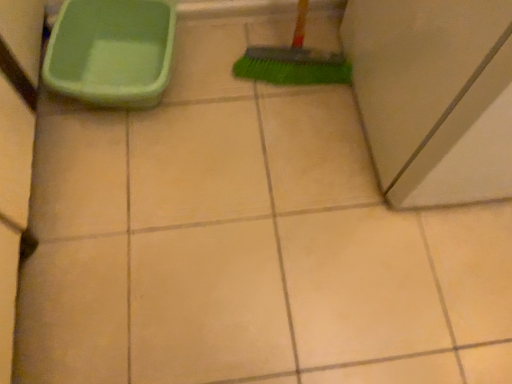
The width and height of the screenshot is (512, 384). I want to click on free spot in front of green plastic bucket at upper left, so click(116, 172).